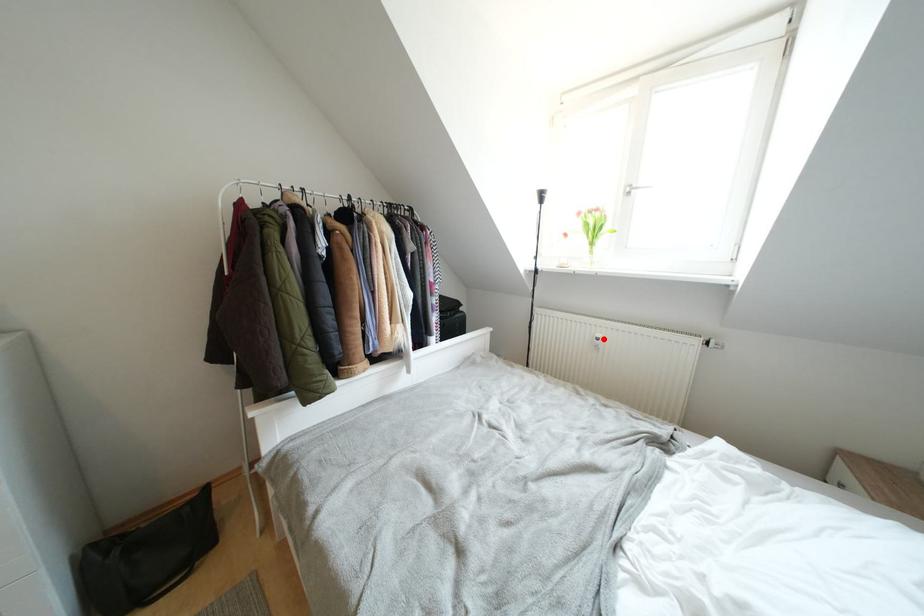
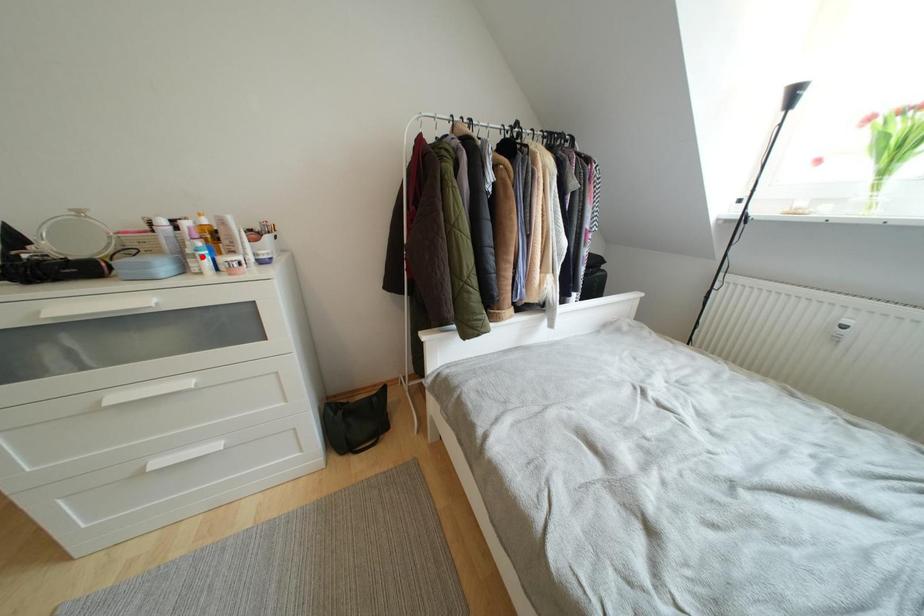
I am providing you with two images of the same scene from different viewpoints. A red point is marked on the first image and another point is marked on the second image. Do the highlighted points in image1 and image2 indicate the same real-world spot?

No